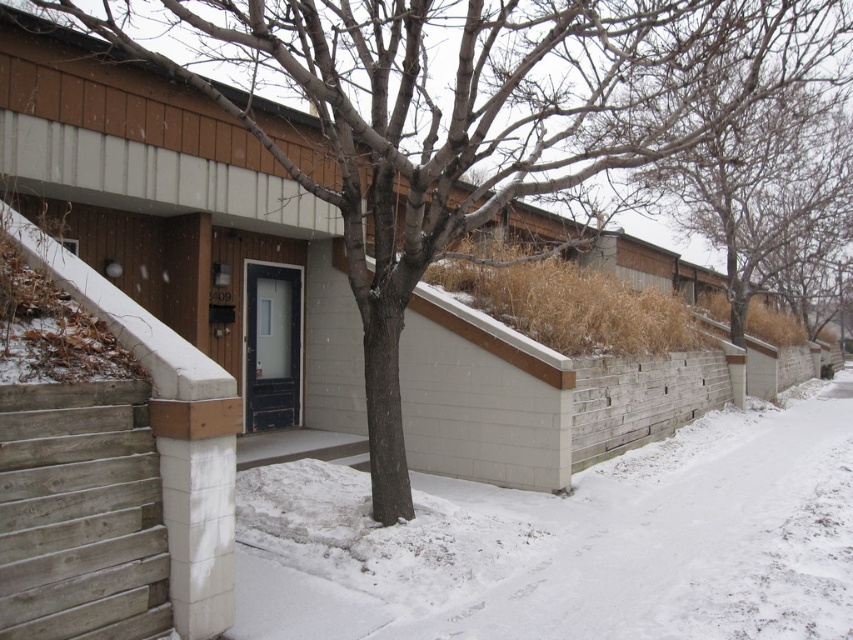
You are standing at the entrance of the building and looking towards the tree. Which object is nearer to you, the white powdery snow at lower center or the bare branches at upper center?

The white powdery snow at lower center is closer to the viewer than the bare branches at upper center.